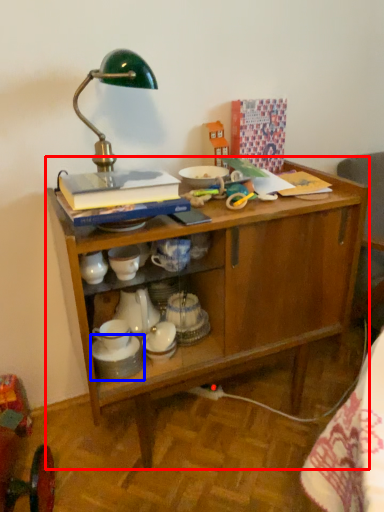
Question: Which object appears farthest to the camera in this image, desk (highlighted by a red box) or tableware (highlighted by a blue box)?

Choices:
 (A) desk
 (B) tableware

Answer: (B)